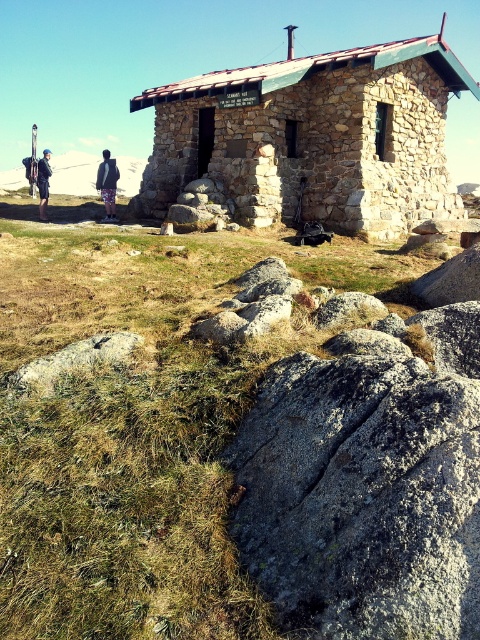
Can you confirm if matte black skis at left is smaller than printed fabric pants at center?

No, matte black skis at left is not smaller than printed fabric pants at center.

Between matte black skis at left and printed fabric pants at center, which one appears on the left side from the viewer's perspective?

Positioned to the left is matte black skis at left.

Image resolution: width=480 pixels, height=640 pixels. Describe the element at coordinates (73, 173) in the screenshot. I see `matte black skis at left` at that location.

The width and height of the screenshot is (480, 640). In order to click on matte black skis at left in this screenshot , I will do `click(73, 173)`.

Can you confirm if gray rough boulder at lower left is smaller than matte black skis at left?

Yes, gray rough boulder at lower left is smaller than matte black skis at left.

Does gray rough boulder at lower left come behind matte black skis at left?

No.

Locate an element on the screen. gray rough boulder at lower left is located at coordinates (73, 360).

Who is shorter, gray rough boulder at lower left or printed fabric pants at center?

gray rough boulder at lower left is shorter.

Consider the image. Does gray rough boulder at lower left lie in front of printed fabric pants at center?

Yes, it is in front of printed fabric pants at center.

Find the location of `gray rough boulder at lower left`. gray rough boulder at lower left is located at coordinates (73, 360).